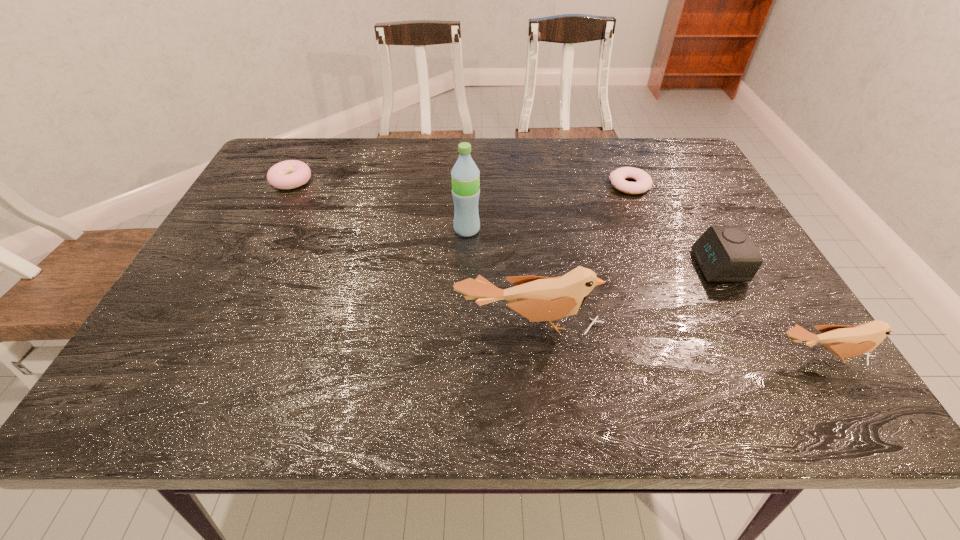
Where is `the fourth tallest object`? This screenshot has height=540, width=960. the fourth tallest object is located at coordinates (724, 253).

I want to click on alarm clock, so tap(724, 253).

Identify the location of free point located 0.370m on the left of the fourth object from left to right. (477, 185).

The height and width of the screenshot is (540, 960). What are the coordinates of `vacant space located on the right of the water bottle` in the screenshot? It's located at (588, 230).

This screenshot has height=540, width=960. Find the location of `blank area located on the front of the leftmost object`. blank area located on the front of the leftmost object is located at coordinates (276, 208).

Locate an element on the screen. This screenshot has height=540, width=960. vacant space located on the front-facing side of the alarm clock is located at coordinates (624, 266).

The width and height of the screenshot is (960, 540). Find the location of `vacant space located 0.390m on the front-facing side of the alarm clock`. vacant space located 0.390m on the front-facing side of the alarm clock is located at coordinates (527, 266).

Find the location of a particular element. vacant space positioned on the front-facing side of the alarm clock is located at coordinates (523, 266).

Locate an element on the screen. object that is at the left edge is located at coordinates (289, 174).

The width and height of the screenshot is (960, 540). In order to click on bird situated at the right edge in this screenshot , I will do `click(844, 341)`.